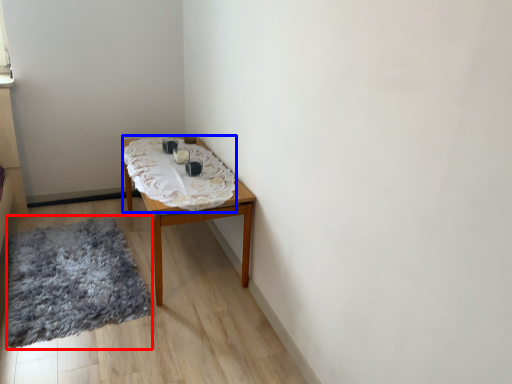
Question: Which point is further to the camera, mat (highlighted by a red box) or blanket (highlighted by a blue box)?

Choices:
 (A) mat
 (B) blanket

Answer: (B)